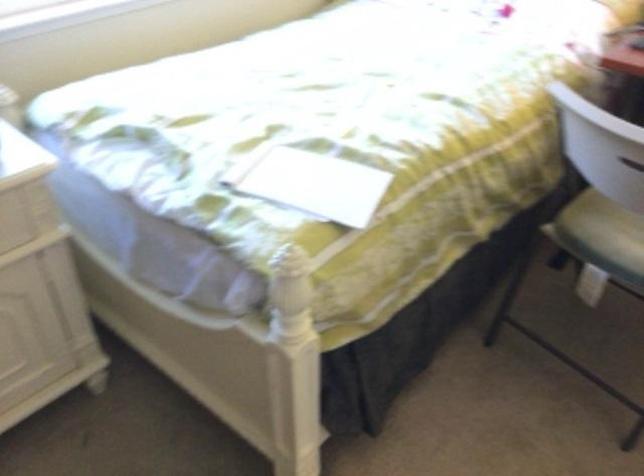
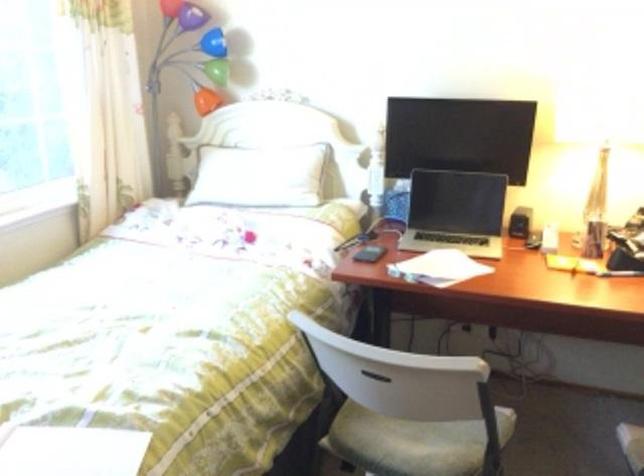
First-person continuous shooting, in which direction is the camera rotating?

The camera's rotation is toward right-up.